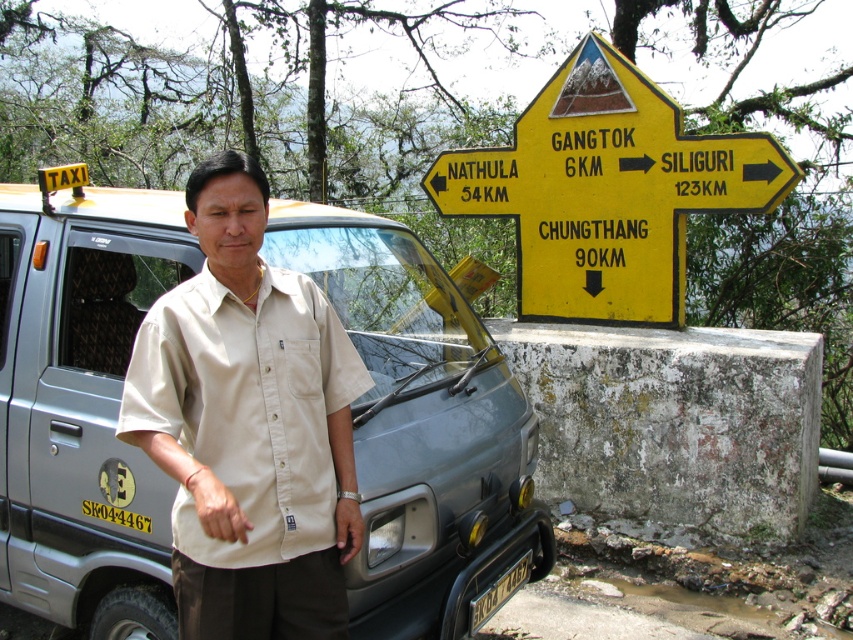
Is silver metallic taxi at left positioned in front of yellow plastic license plate at lower center?

Yes, silver metallic taxi at left is in front of yellow plastic license plate at lower center.

Which of these two, silver metallic taxi at left or yellow plastic license plate at lower center, stands taller?

silver metallic taxi at left

Measure the distance between silver metallic taxi at left and camera.

silver metallic taxi at left is 8.87 feet from camera.

Locate an element on the screen. silver metallic taxi at left is located at coordinates (82, 406).

Consider the image. Measure the distance between point [114,449] and camera.

A distance of 9.83 feet exists between point [114,449] and camera.

Is silver metallic taxi at left to the left of beige cotton shirt at center from the viewer's perspective?

No, silver metallic taxi at left is not to the left of beige cotton shirt at center.

Does point (102, 209) lie behind point (271, 289)?

Yes.

Locate an element on the screen. Image resolution: width=853 pixels, height=640 pixels. silver metallic taxi at left is located at coordinates (82, 406).

Is point (579, 285) less distant than point (511, 586)?

No, (579, 285) is behind (511, 586).

Is yellow plastic sign at upper right bigger than yellow plastic license plate at lower center?

Correct, yellow plastic sign at upper right is larger in size than yellow plastic license plate at lower center.

Does point (576, 100) lie behind point (488, 596)?

Yes.

What are the coordinates of `yellow plastic sign at upper right` in the screenshot? It's located at (606, 189).